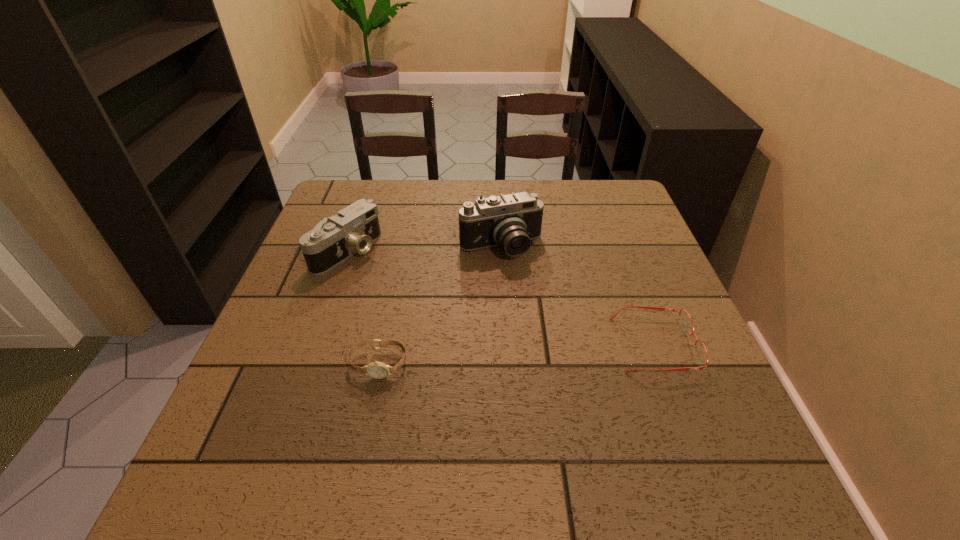
At what (x,y) coordinates should I click in order to perform the action: click on watch. Please return your answer as a coordinate pair (x, y). The width and height of the screenshot is (960, 540). Looking at the image, I should click on (378, 370).

This screenshot has width=960, height=540. I want to click on the shortest object, so click(x=686, y=323).

The image size is (960, 540). Find the location of `the rightmost object`. the rightmost object is located at coordinates (686, 323).

What are the coordinates of `the shorter camera` in the screenshot? It's located at (353, 230).

Locate an element on the screen. the left camera is located at coordinates (353, 230).

This screenshot has height=540, width=960. I want to click on the right camera, so click(511, 221).

Identify the location of the taller camera. 511,221.

You are a GUI agent. You are given a task and a screenshot of the screen. Output one action in this format:
    pyautogui.click(x=<x>, y=<y>)
    Task: Click on the vacant space situated on the face of the third object from right to left
    Image resolution: width=960 pixels, height=540 pixels.
    Given the screenshot: What is the action you would take?
    pyautogui.click(x=365, y=428)

Find the location of a particular element. vacant region located on the lens of the left camera is located at coordinates (463, 319).

This screenshot has height=540, width=960. I want to click on free region located on the lens of the left camera, so click(413, 291).